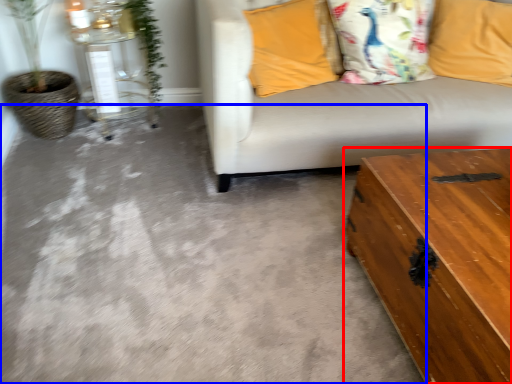
Question: Which point is further to the camera, table (highlighted by a red box) or concrete (highlighted by a blue box)?

Choices:
 (A) table
 (B) concrete

Answer: (B)